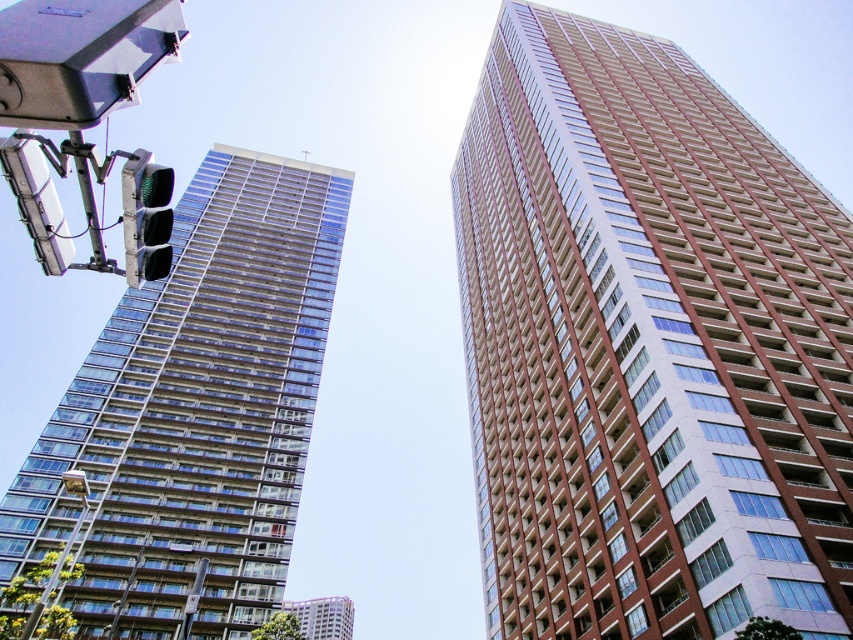
Does brown brick building at center have a lesser height compared to green glass traffic light at upper left?

Incorrect, brown brick building at center's height does not fall short of green glass traffic light at upper left's.

Who is lower down, brown brick building at center or green glass traffic light at upper left?

Positioned lower is green glass traffic light at upper left.

Does point (807, 497) come farther from viewer compared to point (129, 244)?

Yes, point (807, 497) is behind point (129, 244).

Where is `brown brick building at center`? The width and height of the screenshot is (853, 640). brown brick building at center is located at coordinates (648, 348).

Who is higher up, green glass traffic light at upper left or matte glass building at lower center?

green glass traffic light at upper left is above.

You are a GUI agent. You are given a task and a screenshot of the screen. Output one action in this format:
    pyautogui.click(x=<x>, y=<y>)
    Task: Click on the green glass traffic light at upper left
    The image size is (853, 640).
    Given the screenshot: What is the action you would take?
    pyautogui.click(x=146, y=218)

Between point (635, 42) and point (291, 525), which one is positioned in front?

Point (291, 525) is more forward.

Can you confirm if brown brick building at center is positioned below clear glass building at left?

Actually, brown brick building at center is above clear glass building at left.

Between point (756, 508) and point (289, 340), which one is positioned in front?

Point (756, 508) is more forward.

Locate an element on the screen. brown brick building at center is located at coordinates point(648,348).